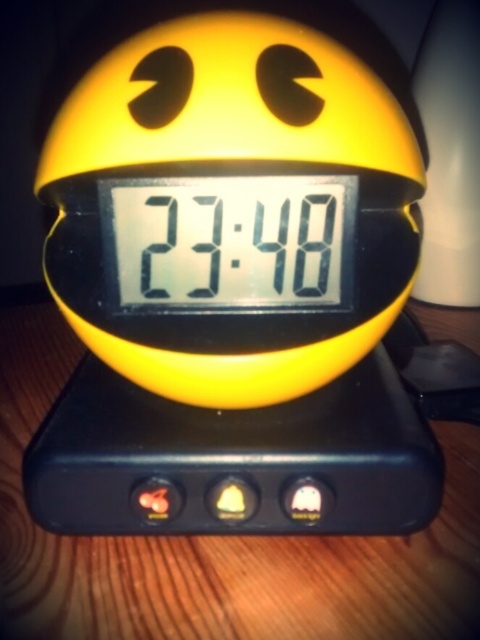
Question: Can you confirm if black plastic scale at center is positioned to the right of wooden table at center?

Choices:
 (A) yes
 (B) no

Answer: (A)

Question: Can you confirm if black plastic scale at center is positioned to the left of wooden table at center?

Choices:
 (A) yes
 (B) no

Answer: (B)

Question: Which point appears farthest from the camera in this image?

Choices:
 (A) coord(372,292)
 (B) coord(317,556)

Answer: (B)

Question: From the image, what is the correct spatial relationship of black plastic scale at center in relation to wooden table at center?

Choices:
 (A) above
 (B) below

Answer: (A)

Question: Which object is closer to the camera taking this photo?

Choices:
 (A) black plastic scale at center
 (B) wooden table at center

Answer: (A)